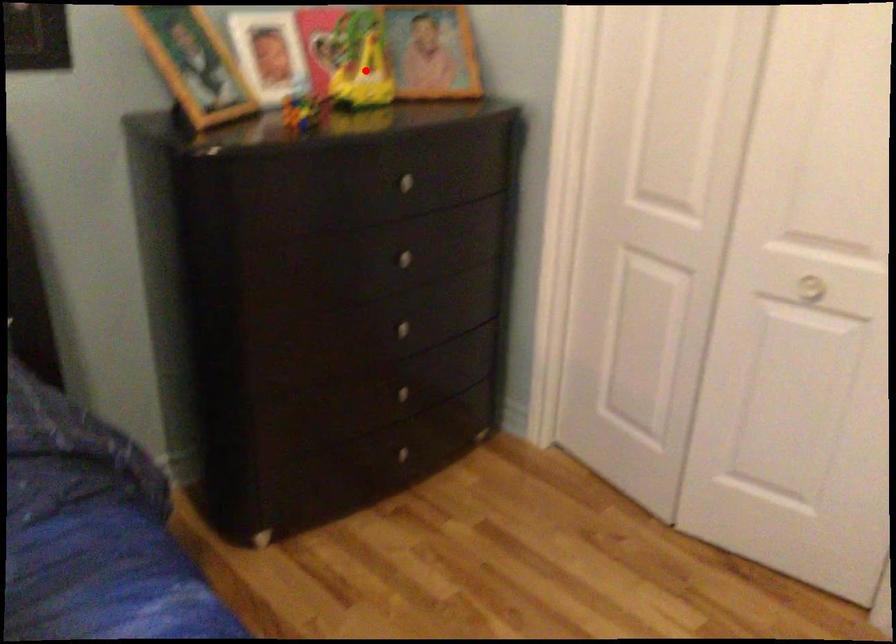
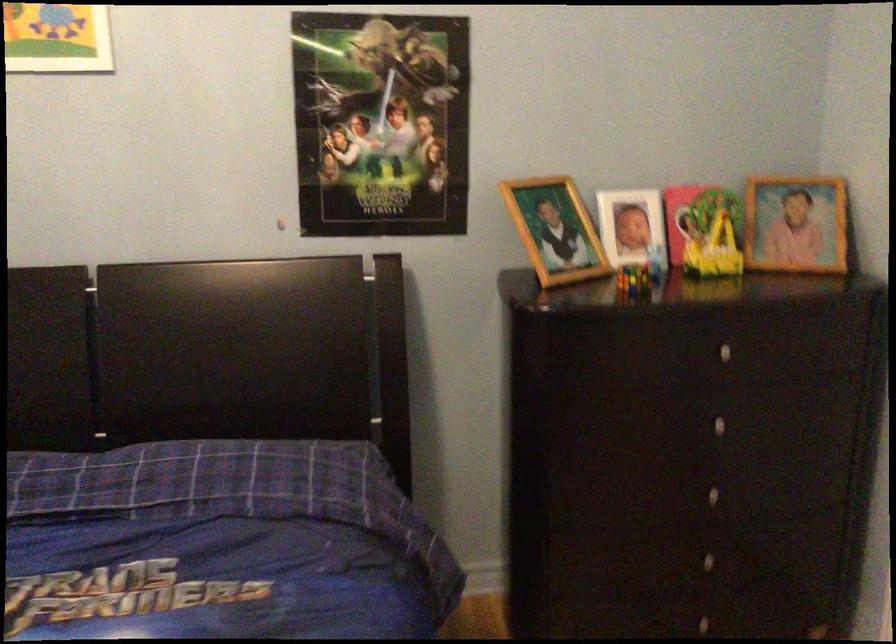
The point at the highlighted location is marked in the first image. Where is the corresponding point in the second image?

(719, 240)